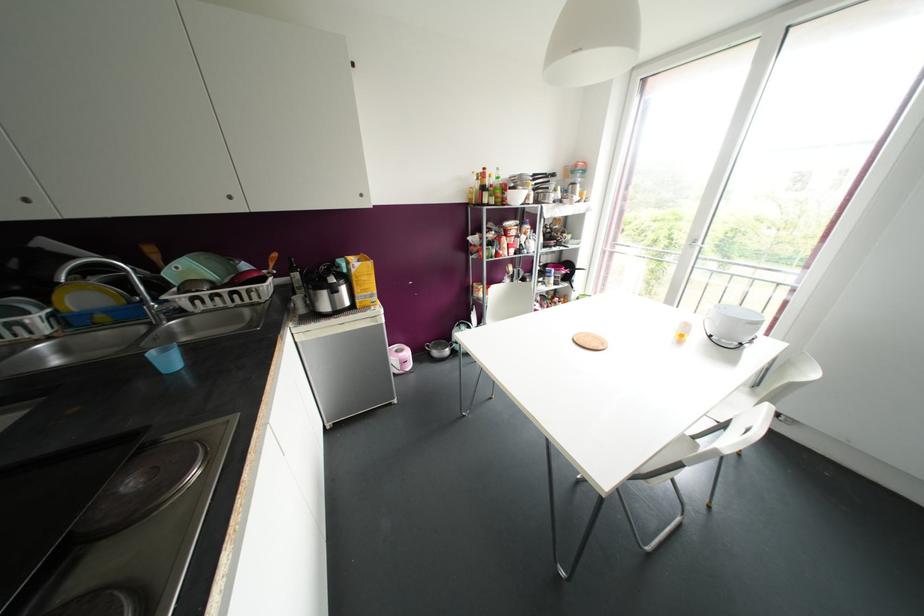
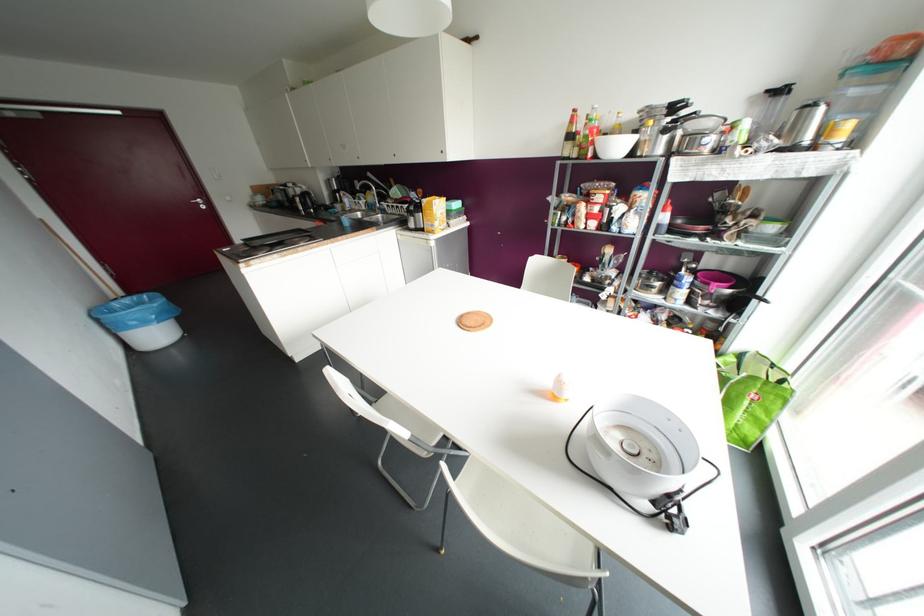
Locate, in the second image, the point that corresponds to (483,168) in the first image.

(574, 110)